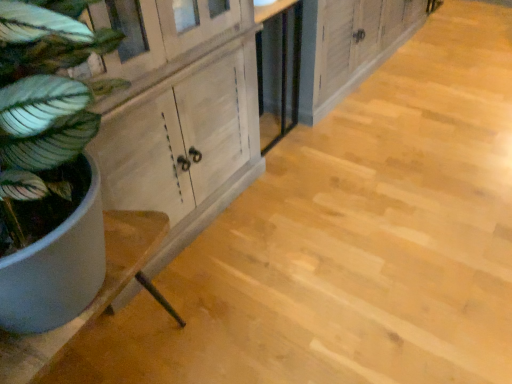
Where is `wooden cabinet at center`? The height and width of the screenshot is (384, 512). wooden cabinet at center is located at coordinates (357, 43).

Locate an element on the screen. green matte plant at left is located at coordinates (49, 165).

What do you see at coordinates (95, 297) in the screenshot?
I see `white wood counter at left` at bounding box center [95, 297].

The image size is (512, 384). Find the location of `wooden cabinet at center`. wooden cabinet at center is located at coordinates (357, 43).

Does wooden cabinet at center have a smaller size compared to green matte plant at left?

No, wooden cabinet at center is not smaller than green matte plant at left.

From the picture: Is wooden cabinet at center looking in the opposite direction of green matte plant at left?

That's not correct — wooden cabinet at center is not looking away from green matte plant at left.

Choose the correct answer: Is wooden cabinet at center inside green matte plant at left or outside it?

wooden cabinet at center is not inside green matte plant at left, it's outside.

Considering the points (425, 12) and (69, 289), which point is in front, point (425, 12) or point (69, 289)?

The point (69, 289) is closer to the camera.

From the picture: Which object is more forward, green matte plant at left or white wood counter at left?

green matte plant at left is closer to the camera.

Who is smaller, green matte plant at left or white wood counter at left?

white wood counter at left is smaller.

Between green matte plant at left and white wood counter at left, which one has more height?

green matte plant at left.

The height and width of the screenshot is (384, 512). In order to click on counter lying below the green matte plant at left (from the image's perspective) in this screenshot , I will do `click(95, 297)`.

Does white wood counter at left appear on the left side of green matte plant at left?

Yes, white wood counter at left is to the left of green matte plant at left.

From the image's perspective, is white wood counter at left below green matte plant at left?

Yes, from the image's perspective, white wood counter at left is beneath green matte plant at left.

Considering the relative sizes of white wood counter at left and green matte plant at left in the image provided, is white wood counter at left taller than green matte plant at left?

No.

Considering the relative sizes of wooden cabinet at center and white wood counter at left in the image provided, is wooden cabinet at center smaller than white wood counter at left?

Incorrect, wooden cabinet at center is not smaller in size than white wood counter at left.

From the image's perspective, is wooden cabinet at center on top of white wood counter at left?

Correct, wooden cabinet at center appears higher than white wood counter at left in the image.

Which object is closer to the camera, wooden cabinet at center or white wood counter at left?

white wood counter at left.

Can you confirm if wooden cabinet at center is thinner than white wood counter at left?

No.

Does point (55, 338) come closer to viewer compared to point (325, 34)?

That is True.

Can you confirm if white wood counter at left is bigger than wooden cabinet at center?

Actually, white wood counter at left might be smaller than wooden cabinet at center.

Is there a large distance between white wood counter at left and wooden cabinet at center?

Absolutely, white wood counter at left is distant from wooden cabinet at center.

I want to click on counter on the left of wooden cabinet at center, so click(95, 297).

Based on the photo, from the image's perspective, which object appears higher, green matte plant at left or wooden cabinet at center?

wooden cabinet at center.

Considering the positions of points (55, 123) and (315, 102), is point (55, 123) farther from camera compared to point (315, 102)?

No, (55, 123) is closer to viewer.

Does green matte plant at left have a lesser height compared to wooden cabinet at center?

No, green matte plant at left is not shorter than wooden cabinet at center.

Is green matte plant at left bigger than wooden cabinet at center?

No.

Find the location of a particular element. The image size is (512, 384). cabinetry above the green matte plant at left (from the image's perspective) is located at coordinates (357, 43).

Locate an element on the screen. Image resolution: width=512 pixels, height=384 pixels. counter on the left of green matte plant at left is located at coordinates (95, 297).

Based on their spatial positions, is white wood counter at left or wooden cabinet at center closer to green matte plant at left?

white wood counter at left is closer to green matte plant at left.

When comparing their distances from white wood counter at left, does green matte plant at left or wooden cabinet at center seem further?

wooden cabinet at center.

Considering their positions, is wooden cabinet at center positioned further to white wood counter at left than green matte plant at left?

wooden cabinet at center.

Based on their spatial positions, is white wood counter at left or green matte plant at left closer to wooden cabinet at center?

Based on the image, white wood counter at left appears to be nearer to wooden cabinet at center.

From the image, which object appears to be farther from wooden cabinet at center, green matte plant at left or white wood counter at left?

Among the two, green matte plant at left is located further to wooden cabinet at center.

Which object lies further to the anchor point green matte plant at left, wooden cabinet at center or white wood counter at left?

wooden cabinet at center is further to green matte plant at left.

Identify the location of counter located between green matte plant at left and wooden cabinet at center in the depth direction. (95, 297).